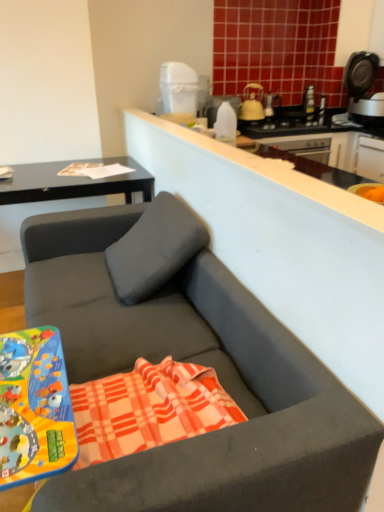
This screenshot has height=512, width=384. Find the location of `black plastic coffee machine at upper right`. black plastic coffee machine at upper right is located at coordinates (363, 89).

What is the approximate width of white plastic trash can at upper center?

The width of white plastic trash can at upper center is 29.74 centimeters.

Locate an element on the screen. Image resolution: width=384 pixels, height=512 pixels. matte gray studio couch at center is located at coordinates (199, 362).

You are a GUI agent. You are given a task and a screenshot of the screen. Output one action in this format:
    pyautogui.click(x=<x>, y=<y>)
    Task: Click on the plaid cotton beach towel at center
    
    Given the screenshot: What is the action you would take?
    pyautogui.click(x=148, y=409)

Would you say white plastic trash can at upper center is part of matte gray studio couch at center's contents?

No, white plastic trash can at upper center is not inside matte gray studio couch at center.

From the picture: From the image's perspective, is matte gray studio couch at center positioned above or below white plastic trash can at upper center?

Based on their image positions, matte gray studio couch at center is located beneath white plastic trash can at upper center.

Is white plastic trash can at upper center at the back of matte gray studio couch at center?

No, matte gray studio couch at center is not facing away from white plastic trash can at upper center.

From the picture: Considering the positions of objects matte gray studio couch at center and white plastic trash can at upper center in the image provided, who is more to the left, matte gray studio couch at center or white plastic trash can at upper center?

matte gray studio couch at center.

Find the location of `coffee machine above the yellow matte kettle at upper center (from a real-world perspective)`. coffee machine above the yellow matte kettle at upper center (from a real-world perspective) is located at coordinates (363, 89).

Does yellow matte kettle at upper center lie behind black plastic coffee machine at upper right?

Yes, it is.

Is yellow matte kettle at upper center to the left of black plastic coffee machine at upper right from the viewer's perspective?

Indeed, yellow matte kettle at upper center is positioned on the left side of black plastic coffee machine at upper right.

In terms of height, does yellow matte kettle at upper center look taller or shorter compared to black plastic coffee machine at upper right?

yellow matte kettle at upper center is shorter than black plastic coffee machine at upper right.

Does yellow matte kettle at upper center turn towards white plastic trash can at upper center?

No, yellow matte kettle at upper center is not facing towards white plastic trash can at upper center.

Consider the image. Considering the positions of objects yellow matte kettle at upper center and white plastic trash can at upper center in the image provided, who is in front, yellow matte kettle at upper center or white plastic trash can at upper center?

white plastic trash can at upper center is more forward.

Is yellow matte kettle at upper center inside or outside of white plastic trash can at upper center?

yellow matte kettle at upper center lies outside white plastic trash can at upper center.

Is point (250, 117) more distant than point (164, 66)?

Yes, it is behind point (164, 66).

Can you confirm if plaid cotton beach towel at center is positioned to the right of white plastic trash can at upper center?

Yes, plaid cotton beach towel at center is to the right of white plastic trash can at upper center.

Consider the image. Is plaid cotton beach towel at center spatially inside white plastic trash can at upper center, or outside of it?

plaid cotton beach towel at center is located beyond the bounds of white plastic trash can at upper center.

Is plaid cotton beach towel at center placed right next to white plastic trash can at upper center?

plaid cotton beach towel at center and white plastic trash can at upper center are clearly separated.

Can you confirm if transparent plastic bottle at upper center is taller than plaid cotton beach towel at center?

Yes.

Is the surface of transparent plastic bottle at upper center in direct contact with plaid cotton beach towel at center?

No, transparent plastic bottle at upper center is not with plaid cotton beach towel at center.

Is point (221, 118) in front of point (98, 403)?

No, (221, 118) is behind (98, 403).

From the image's perspective, between black plastic coffee machine at upper right and metallic plastic game board at lower left, which one is located above?

black plastic coffee machine at upper right.

Considering the relative positions of black plastic coffee machine at upper right and metallic plastic game board at lower left in the image provided, is black plastic coffee machine at upper right to the right of metallic plastic game board at lower left from the viewer's perspective?

Indeed, black plastic coffee machine at upper right is positioned on the right side of metallic plastic game board at lower left.

Which of these two, black plastic coffee machine at upper right or metallic plastic game board at lower left, stands taller?

metallic plastic game board at lower left.

Is black plastic coffee machine at upper right facing towards metallic plastic game board at lower left?

No, black plastic coffee machine at upper right does not turn towards metallic plastic game board at lower left.

Does matte black desk at upper left have a smaller size compared to matte gray studio couch at center?

Yes.

Looking at this image, which object is thinner, matte black desk at upper left or matte gray studio couch at center?

With smaller width is matte black desk at upper left.

Can matte gray studio couch at center be found inside matte black desk at upper left?

No.

You are a GUI agent. You are given a task and a screenshot of the screen. Output one action in this format:
    pyautogui.click(x=<x>, y=<y>)
    Task: Click on the appliance above the matte gray studio couch at center (from a real-world perspective)
    This screenshot has height=512, width=384.
    Given the screenshot: What is the action you would take?
    pyautogui.click(x=179, y=88)

At what (x,y) coordinates should I click in order to perform the action: click on coffee machine on the right side of yellow matte kettle at upper center. Please return your answer as a coordinate pair (x, y). The image size is (384, 512). Looking at the image, I should click on (363, 89).

Based on their spatial positions, is white plastic trash can at upper center or metallic plastic game board at lower left closer to transparent plastic bottle at upper center?

white plastic trash can at upper center is positioned closer to the anchor transparent plastic bottle at upper center.

Considering their positions, is white glossy counter top at upper center positioned closer to metallic plastic game board at lower left than plaid cotton beach towel at center?

Based on the image, plaid cotton beach towel at center appears to be nearer to metallic plastic game board at lower left.

Looking at the image, which one is located further to black plastic coffee machine at upper right, matte gray studio couch at center or transparent plastic bottle at upper center?

Based on the image, matte gray studio couch at center appears to be further to black plastic coffee machine at upper right.

Considering their positions, is matte black desk at upper left positioned further to transparent plastic bottle at upper center than matte gray studio couch at center?

Among the two, matte gray studio couch at center is located further to transparent plastic bottle at upper center.

From the image, which object appears to be nearer to yellow matte kettle at upper center, black plastic coffee machine at upper right or matte gray studio couch at center?

Among the two, black plastic coffee machine at upper right is located nearer to yellow matte kettle at upper center.

Considering their positions, is metallic plastic game board at lower left positioned further to yellow matte kettle at upper center than black plastic coffee machine at upper right?

metallic plastic game board at lower left.

Which object lies nearer to the anchor point plaid cotton beach towel at center, yellow matte kettle at upper center or transparent plastic bottle at upper center?

transparent plastic bottle at upper center is positioned closer to the anchor plaid cotton beach towel at center.

Based on their spatial positions, is plaid cotton beach towel at center or matte black desk at upper left further from black plastic coffee machine at upper right?

plaid cotton beach towel at center is positioned further to the anchor black plastic coffee machine at upper right.

Where is `beach towel located between matte gray studio couch at center and white plastic trash can at upper center in the depth direction`? The image size is (384, 512). beach towel located between matte gray studio couch at center and white plastic trash can at upper center in the depth direction is located at coordinates (148, 409).

This screenshot has height=512, width=384. I want to click on bottle between white glossy counter top at upper center and yellow matte kettle at upper center from front to back, so click(x=226, y=124).

Locate an element on the screen. appliance positioned between metallic plastic game board at lower left and yellow matte kettle at upper center from near to far is located at coordinates (179, 88).

Locate an element on the screen. The height and width of the screenshot is (512, 384). bottle located between white plastic trash can at upper center and black plastic coffee machine at upper right in the left-right direction is located at coordinates (226, 124).